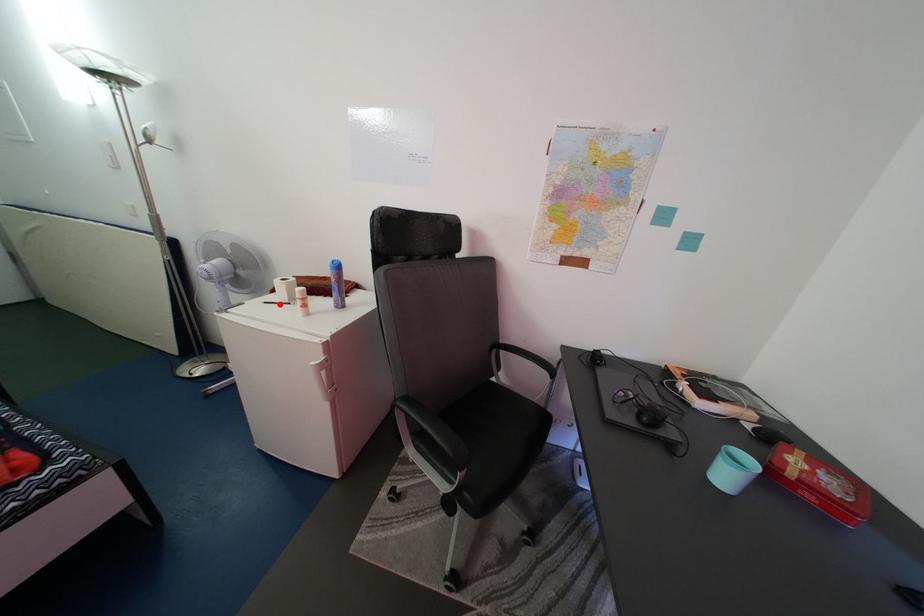
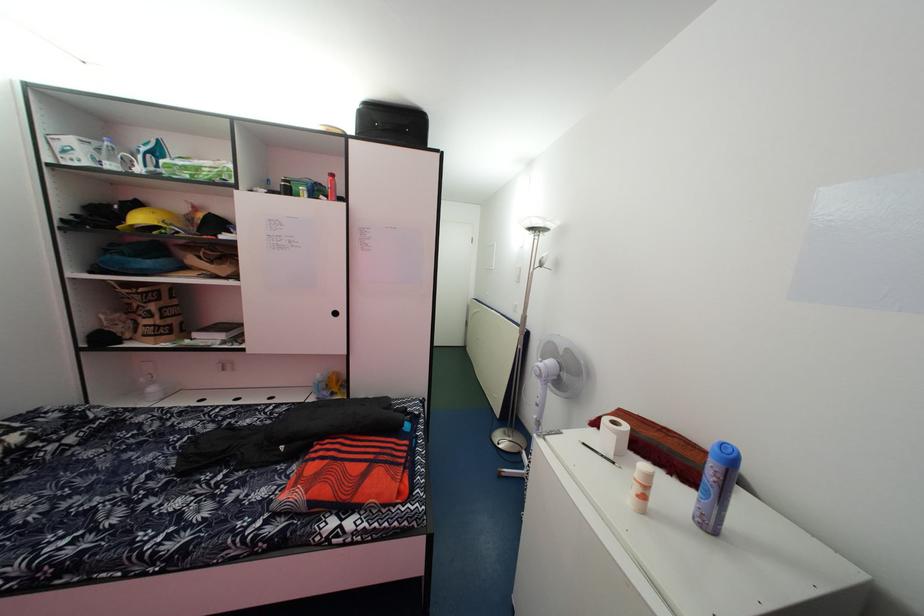
Question: I am providing you with two images of the same scene from different viewpoints. In image1, a red point is highlighted. Considering the same 3D point in image2, which of the following is correct?

Choices:
 (A) It is closer
 (B) It is farther

Answer: (A)